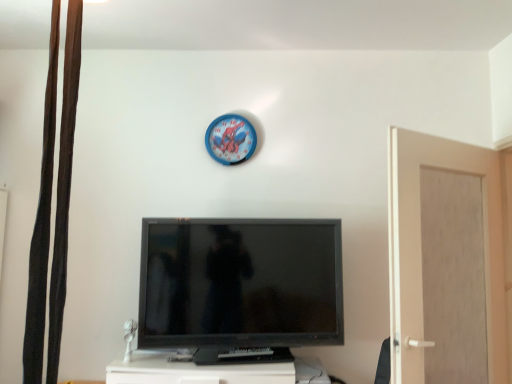
The height and width of the screenshot is (384, 512). In order to click on black fabric curtain at left in this screenshot , I will do `click(42, 223)`.

Image resolution: width=512 pixels, height=384 pixels. Describe the element at coordinates (445, 262) in the screenshot. I see `beige matte door at right` at that location.

This screenshot has height=384, width=512. I want to click on beige matte door at right, so tap(445, 262).

Describe the element at coordinates (240, 283) in the screenshot. I see `black glossy television at center` at that location.

Locate an element on the screen. The width and height of the screenshot is (512, 384). black fabric curtain at left is located at coordinates (42, 223).

Is black fabric curtain at left in front of or behind beige matte door at right in the image?

Visually, black fabric curtain at left is located in front of beige matte door at right.

Is black fabric curtain at left positioned beyond the bounds of beige matte door at right?

Yes, black fabric curtain at left is not within beige matte door at right.

Considering the relative sizes of black fabric curtain at left and beige matte door at right in the image provided, is black fabric curtain at left thinner than beige matte door at right?

Correct, the width of black fabric curtain at left is less than that of beige matte door at right.

Considering the relative positions of black fabric curtain at left and beige matte door at right in the image provided, is black fabric curtain at left to the right of beige matte door at right from the viewer's perspective?

No.

In the scene shown: Is blue plastic clock at upper center smaller than black glossy television at center?

Correct, blue plastic clock at upper center occupies less space than black glossy television at center.

From the image's perspective, which is above, blue plastic clock at upper center or black glossy television at center?

blue plastic clock at upper center is shown above in the image.

In the scene shown: Considering the relative sizes of blue plastic clock at upper center and black glossy television at center in the image provided, is blue plastic clock at upper center thinner than black glossy television at center?

Indeed, blue plastic clock at upper center has a lesser width compared to black glossy television at center.

Looking at this image, is black fabric curtain at left located within black glossy television at center?

No.

From the picture: Between black glossy television at center and black fabric curtain at left, which one has smaller size?

black fabric curtain at left.

Which point is more distant from viewer, (251, 240) or (38, 212)?

The point (251, 240) is more distant.

From a real-world perspective, is beige matte door at right physically located above or below black glossy television at center?

Clearly, from a real-world perspective, beige matte door at right is above black glossy television at center.

Is beige matte door at right in front of or behind black glossy television at center in the image?

In the image, beige matte door at right appears in front of black glossy television at center.

I want to click on screen door in front of the black glossy television at center, so click(x=445, y=262).

Can you tell me how much beige matte door at right and black glossy television at center differ in facing direction?

The angle between the facing direction of beige matte door at right and the facing direction of black glossy television at center is 26.3 degrees.

Is point (25, 382) closer or farther from the camera than point (213, 124)?

Point (25, 382) is closer to the camera than point (213, 124).

Where is `clock above the black fabric curtain at left (from a real-world perspective)`? clock above the black fabric curtain at left (from a real-world perspective) is located at coordinates (230, 139).

Which object is further away from the camera, black fabric curtain at left or blue plastic clock at upper center?

blue plastic clock at upper center is further away from the camera.

Between black fabric curtain at left and blue plastic clock at upper center, which one has larger size?

black fabric curtain at left.

Consider the image. In terms of height, does black glossy television at center look taller or shorter compared to blue plastic clock at upper center?

In the image, black glossy television at center appears to be taller than blue plastic clock at upper center.

Considering the sizes of objects black glossy television at center and blue plastic clock at upper center in the image provided, who is thinner, black glossy television at center or blue plastic clock at upper center?

With smaller width is blue plastic clock at upper center.

Do you think black glossy television at center is within blue plastic clock at upper center, or outside of it?

black glossy television at center is spatially situated outside blue plastic clock at upper center.

From a real-world perspective, is blue plastic clock at upper center above or below black fabric curtain at left?

blue plastic clock at upper center is above black fabric curtain at left.

Considering the relative positions of blue plastic clock at upper center and black fabric curtain at left in the image provided, is blue plastic clock at upper center to the left of black fabric curtain at left from the viewer's perspective?

In fact, blue plastic clock at upper center is to the right of black fabric curtain at left.

Between blue plastic clock at upper center and black fabric curtain at left, which one has larger width?

black fabric curtain at left.

The height and width of the screenshot is (384, 512). Identify the location of curtain in front of the beige matte door at right. (42, 223).

Identify the location of television lying on the right of blue plastic clock at upper center. This screenshot has width=512, height=384. (240, 283).

Based on their spatial positions, is black fabric curtain at left or black glossy television at center closer to blue plastic clock at upper center?

black glossy television at center.

Estimate the real-world distances between objects in this image. Which object is further from black fabric curtain at left, blue plastic clock at upper center or black glossy television at center?

blue plastic clock at upper center is further to black fabric curtain at left.

When comparing their distances from beige matte door at right, does blue plastic clock at upper center or black glossy television at center seem further?

Among the two, blue plastic clock at upper center is located further to beige matte door at right.

From the image, which object appears to be farther from black fabric curtain at left, black glossy television at center or beige matte door at right?

beige matte door at right is positioned further to the anchor black fabric curtain at left.

When comparing their distances from black fabric curtain at left, does blue plastic clock at upper center or beige matte door at right seem further?

The object further to black fabric curtain at left is beige matte door at right.

Considering their positions, is black fabric curtain at left positioned further to blue plastic clock at upper center than beige matte door at right?

black fabric curtain at left.

Based on their spatial positions, is beige matte door at right or blue plastic clock at upper center closer to black glossy television at center?

beige matte door at right lies closer to black glossy television at center than the other object.

Looking at the image, which one is located further to black fabric curtain at left, beige matte door at right or black glossy television at center?

beige matte door at right is further to black fabric curtain at left.

Image resolution: width=512 pixels, height=384 pixels. What are the coordinates of `television between black fabric curtain at left and beige matte door at right in the horizontal direction` in the screenshot? It's located at click(x=240, y=283).

Identify the location of screen door positioned between black fabric curtain at left and blue plastic clock at upper center from near to far. The width and height of the screenshot is (512, 384). (445, 262).

Find the location of a particular element. The image size is (512, 384). television between blue plastic clock at upper center and beige matte door at right is located at coordinates (240, 283).

This screenshot has width=512, height=384. Find the location of `television between black fabric curtain at left and blue plastic clock at upper center along the z-axis`. television between black fabric curtain at left and blue plastic clock at upper center along the z-axis is located at coordinates (240, 283).